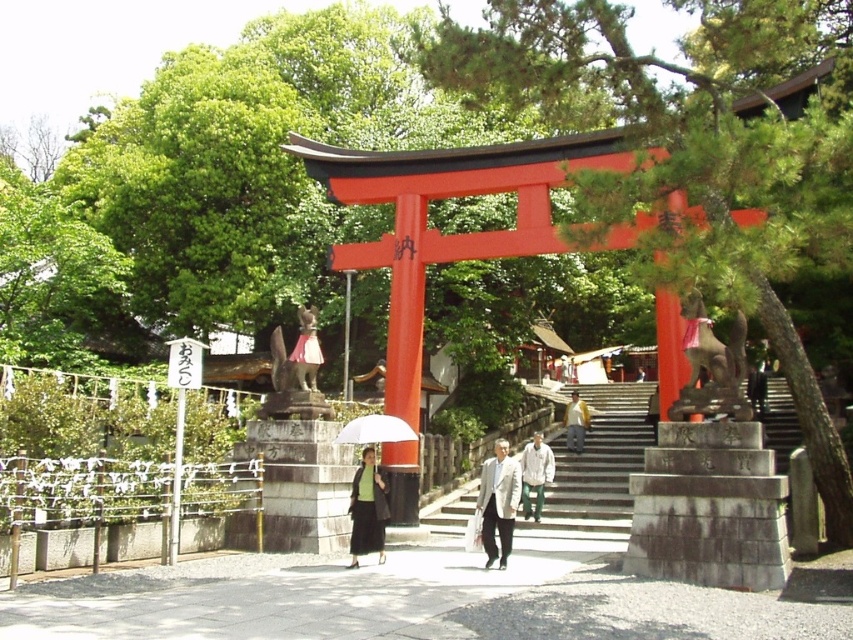
Question: Which point is closer to the camera taking this photo?

Choices:
 (A) (503, 468)
 (B) (309, 307)
 (C) (531, 513)

Answer: (A)

Question: Which object is the closest to the light beige suit at center?

Choices:
 (A) white matte umbrella at center
 (B) matte green skirt at center
 (C) light brown leather jacket at center

Answer: (B)

Question: Which object is positioned farthest from the matte pink skirt at center?

Choices:
 (A) light gray fabric jacket at center
 (B) white matte umbrella at center

Answer: (A)

Question: Observing the image, what is the correct spatial positioning of light beige suit at center in reference to white matte umbrella at center?

Choices:
 (A) above
 (B) below

Answer: (B)

Question: Is matte green skirt at center thinner than white matte umbrella at center?

Choices:
 (A) yes
 (B) no

Answer: (A)

Question: Where is light gray fabric jacket at center located in relation to white matte umbrella at center in the image?

Choices:
 (A) left
 (B) right

Answer: (B)